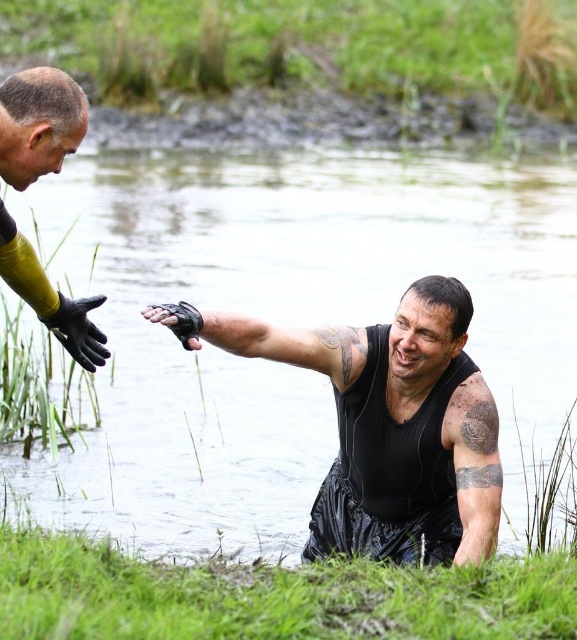
Question: Which object appears closest to the camera in this image?

Choices:
 (A) black matte vest at center
 (B) clear water at center
 (C) black leather glove at center

Answer: (C)

Question: Does black matte vest at center appear on the left side of black rubber glove at upper left?

Choices:
 (A) no
 (B) yes

Answer: (A)

Question: Observing the image, what is the correct spatial positioning of black matte vest at center in reference to black rubber glove at upper left?

Choices:
 (A) below
 (B) above

Answer: (A)

Question: Which object is positioned farthest from the black rubber glove at upper left?

Choices:
 (A) clear water at center
 (B) yellow rubber glove at left
 (C) black tattooed muscle at upper right

Answer: (A)

Question: Is clear water at center below black leather glove at center?

Choices:
 (A) no
 (B) yes

Answer: (A)

Question: Among these objects, which one is nearest to the camera?

Choices:
 (A) black leather glove at center
 (B) yellow rubber glove at left
 (C) black tattooed muscle at upper right

Answer: (A)